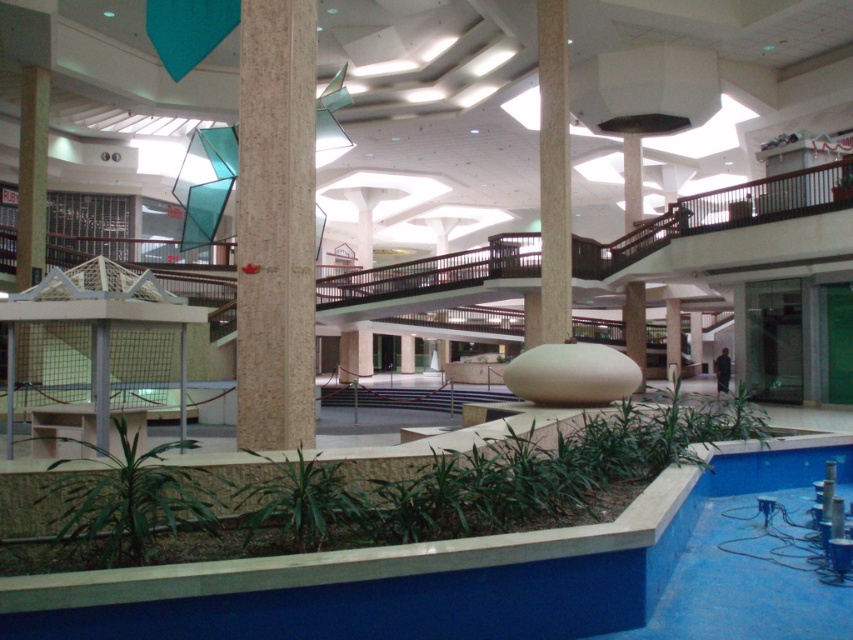
Question: Can you confirm if blue smooth pool at lower center is smaller than green leafy plant at lower left?

Choices:
 (A) no
 (B) yes

Answer: (A)

Question: Does green leafy plant at lower left have a lesser width compared to beige marble pillar at center?

Choices:
 (A) yes
 (B) no

Answer: (B)

Question: Among these points, which one is farthest from the camera?

Choices:
 (A) (268, 380)
 (B) (560, 170)

Answer: (B)

Question: Among these points, which one is nearest to the camera?

Choices:
 (A) (242, 579)
 (B) (550, 244)
 (C) (271, 422)

Answer: (A)

Question: Does green leafy plant at lower left have a smaller size compared to green leafy plant at lower center?

Choices:
 (A) no
 (B) yes

Answer: (A)

Question: Which point appears farthest from the camera in this image?

Choices:
 (A) (292, 230)
 (B) (300, 492)
 (C) (467, 573)
 (D) (192, 492)

Answer: (A)